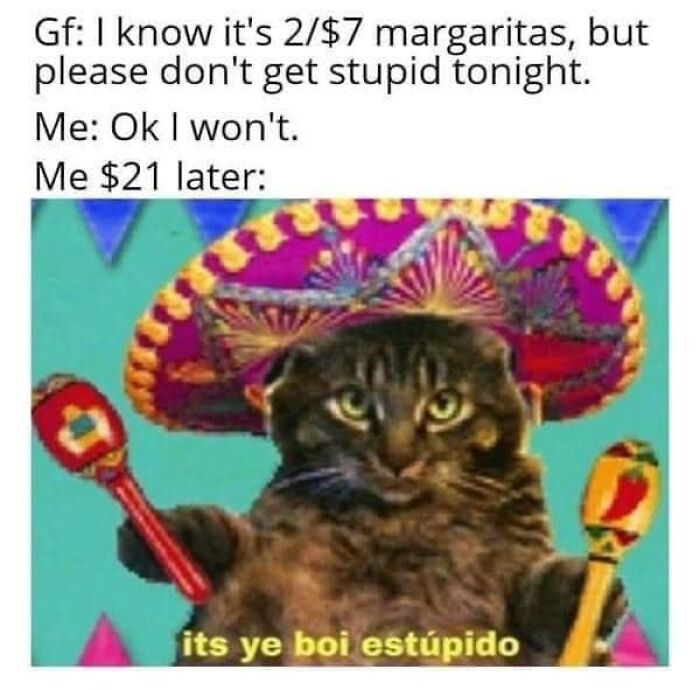
In order to click on decorations in this screenshot , I will do `click(115, 221)`, `click(232, 216)`, `click(631, 219)`, `click(635, 650)`, `click(106, 635)`.